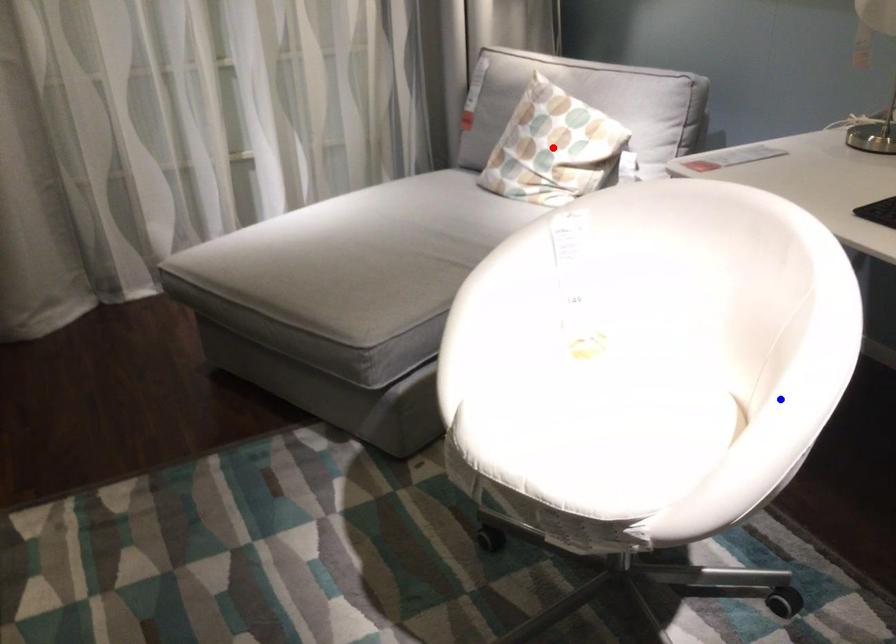
Question: Two points are marked on the image. Which point is closer to the camera?

Choices:
 (A) Blue point is closer.
 (B) Red point is closer.

Answer: (A)